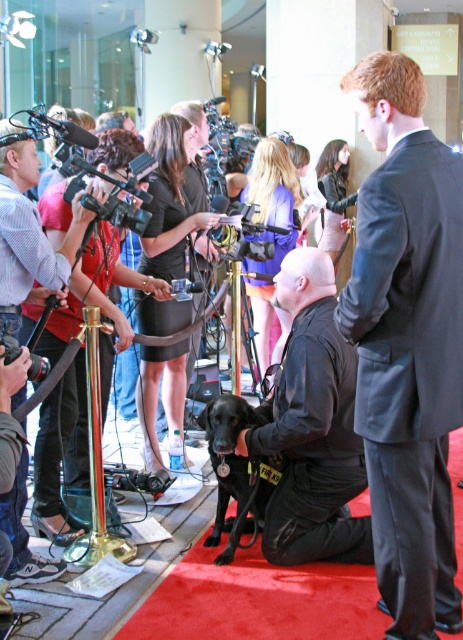
Question: Based on their relative distances, which object is nearer to the black plastic video camera at center?

Choices:
 (A) black leather jacket at center
 (B) dark gray suit at center

Answer: (A)

Question: Is black matte dog at center positioned at the back of black plastic video camera at lower left?

Choices:
 (A) no
 (B) yes

Answer: (B)

Question: Is dark gray suit at center wider than black leather jacket at center?

Choices:
 (A) no
 (B) yes

Answer: (A)

Question: Which object is the farthest from the black matte dog at center?

Choices:
 (A) black leather jacket at center
 (B) black matte video camera at lower left

Answer: (B)

Question: Based on their relative distances, which object is nearer to the black matte video camera at lower left?

Choices:
 (A) black leather jacket at center
 (B) black plastic video camera at lower left
 (C) black matte dog at center

Answer: (C)

Question: Can you confirm if black leather jacket at center is positioned to the right of black matte dog at center?

Choices:
 (A) no
 (B) yes

Answer: (B)